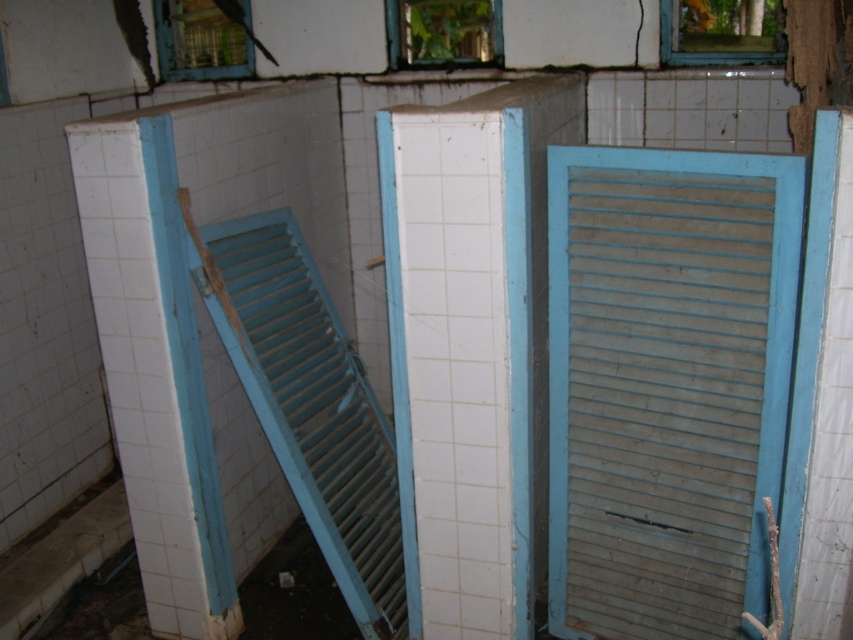
You are standing at the point marked by the coordinate point at (x=646, y=244) in the image. You need to walk to the nearest door, which is either the left or right door. Which door should you go to?

The point at (x=646, y=244) is 2.18 meters away from the nearest door. Since the distance is the same for both doors, you can choose either one.